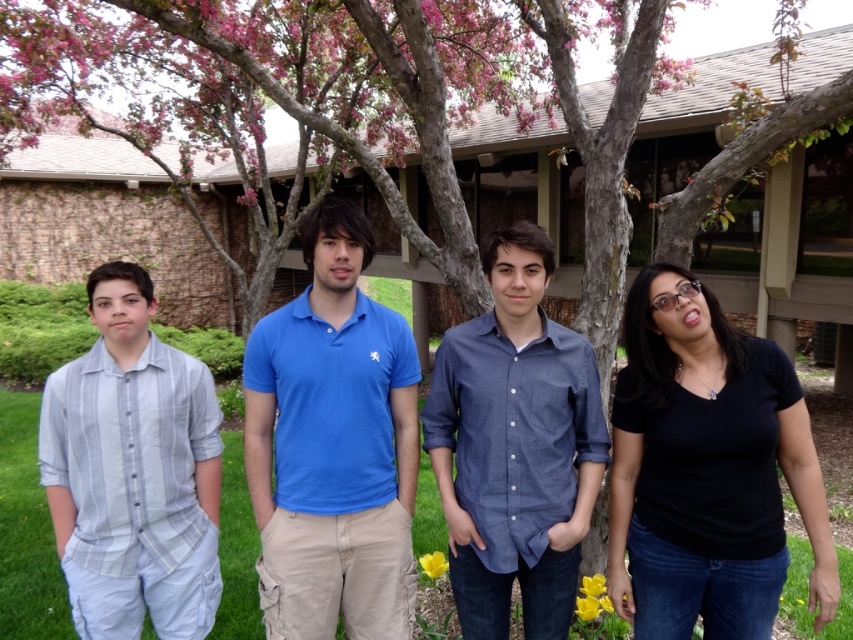
Question: Is black matte shirt at right to the left of blue denim shirt at center from the viewer's perspective?

Choices:
 (A) yes
 (B) no

Answer: (B)

Question: Can you confirm if black matte shirt at right is wider than blue denim shirt at center?

Choices:
 (A) yes
 (B) no

Answer: (A)

Question: Which of the following is the farthest from the observer?

Choices:
 (A) light blue striped shirt at left
 (B) black matte shirt at right
 (C) blue denim shirt at center
 (D) blue cotton polo shirt at center

Answer: (A)

Question: Which of the following is the closest to the observer?

Choices:
 (A) blue cotton polo shirt at center
 (B) light blue striped shirt at left

Answer: (A)

Question: Which point is closer to the camera taking this photo?

Choices:
 (A) (672, 298)
 (B) (476, 588)
 (C) (100, 508)
 (D) (340, 560)

Answer: (A)

Question: Does black matte shirt at right have a lesser width compared to blue cotton polo shirt at center?

Choices:
 (A) yes
 (B) no

Answer: (B)